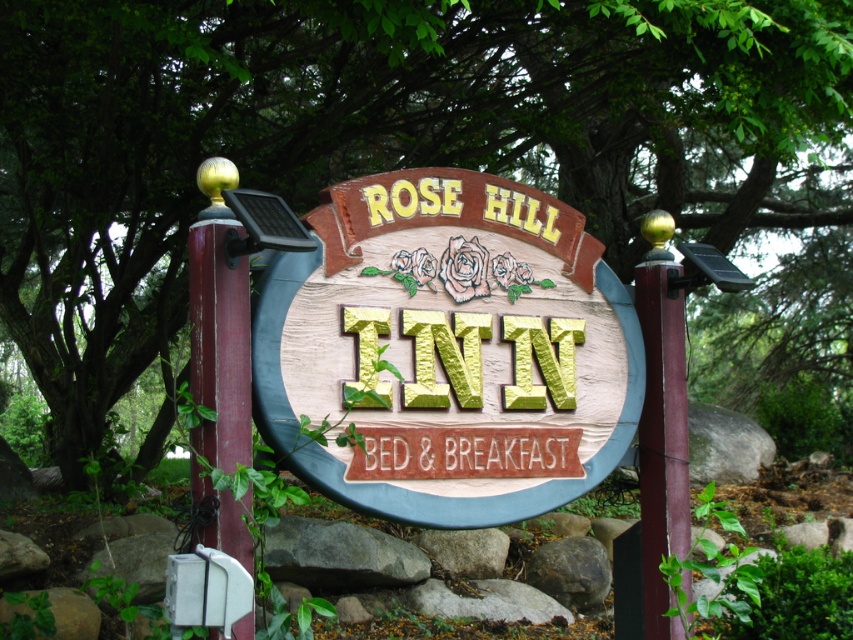
Can you confirm if wooden sign at center is smaller than smooth burgundy post at center?

Actually, wooden sign at center might be larger than smooth burgundy post at center.

Between wooden sign at center and smooth burgundy post at center, which one appears on the right side from the viewer's perspective?

smooth burgundy post at center is more to the right.

Is point (515, 307) positioned before point (637, 305)?

Yes, it is.

Locate an element on the screen. The image size is (853, 640). wooden sign at center is located at coordinates (448, 349).

Is point (235, 372) closer to viewer compared to point (670, 464)?

Yes, it is.

Can you confirm if wooden post at left is smaller than smooth burgundy post at center?

Yes, wooden post at left is smaller than smooth burgundy post at center.

Does point (200, 440) come in front of point (657, 620)?

Yes, it is.

This screenshot has height=640, width=853. I want to click on wooden post at left, so click(219, 339).

Is wooden sign at center thinner than wooden post at left?

No, wooden sign at center is not thinner than wooden post at left.

Between wooden sign at center and wooden post at left, which one is positioned lower?

wooden post at left is below.

Is point (498, 212) less distant than point (228, 326)?

No, (498, 212) is further to viewer.

Identify the location of wooden sign at center. (448, 349).